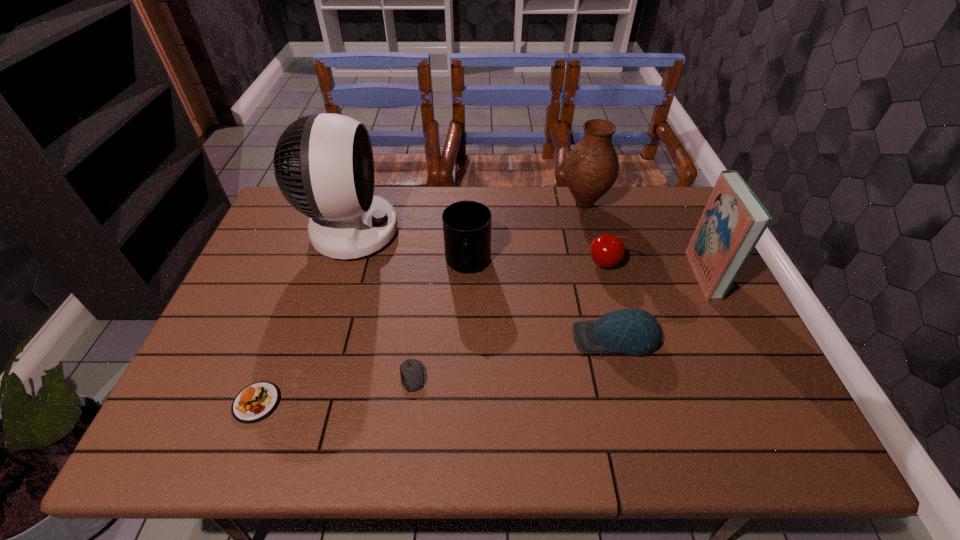
This screenshot has width=960, height=540. Find the location of `free point located 0.060m on the back of the shortest object`. free point located 0.060m on the back of the shortest object is located at coordinates (417, 340).

Where is `fan at the far edge`? fan at the far edge is located at coordinates (324, 166).

Where is `vase that is at the far edge`? vase that is at the far edge is located at coordinates (591, 168).

You are a GUI agent. You are given a task and a screenshot of the screen. Output one action in this format:
    pyautogui.click(x=<x>, y=<y>)
    Task: Click on the object situated at the near edge
    The height and width of the screenshot is (540, 960).
    Given the screenshot: What is the action you would take?
    pyautogui.click(x=255, y=402)

This screenshot has height=540, width=960. Find the location of `fan that is at the left edge`. fan that is at the left edge is located at coordinates (324, 166).

Locate an element on the screen. patty (food) situated at the left edge is located at coordinates (255, 402).

You are a GUI agent. You are given a task and a screenshot of the screen. Output one action in this format:
    pyautogui.click(x=<x>, y=<y>)
    Task: Click on the object that is at the right edge
    This screenshot has width=960, height=540.
    Given the screenshot: What is the action you would take?
    pyautogui.click(x=734, y=219)

At what (x,y) coordinates should I click in order to perform the action: click on object that is positioned at the far left corner. Please return your answer as a coordinate pair (x, y). The height and width of the screenshot is (540, 960). Looking at the image, I should click on (324, 166).

I want to click on object present at the near left corner, so click(x=255, y=402).

You are a GUI agent. You are given a task and a screenshot of the screen. Output one action in this format:
    pyautogui.click(x=<x>, y=<y>)
    Task: Click on the blank space at the far edge of the desktop
    The width and height of the screenshot is (960, 540).
    Given the screenshot: What is the action you would take?
    pyautogui.click(x=420, y=225)